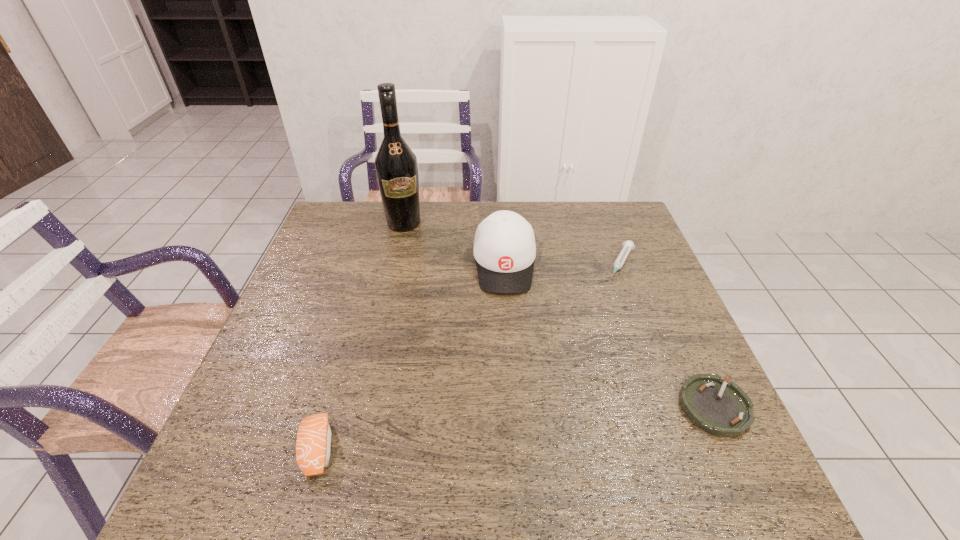
The height and width of the screenshot is (540, 960). Find the location of `free space at the near left corner of the desktop`. free space at the near left corner of the desktop is located at coordinates (270, 444).

Identify the location of vacant space at the far right corner. (x=629, y=223).

Where is `free region at the near right corner`? This screenshot has height=540, width=960. free region at the near right corner is located at coordinates (718, 437).

Where is `free space between the ashtray and the third tallest object`? This screenshot has width=960, height=540. free space between the ashtray and the third tallest object is located at coordinates (516, 428).

This screenshot has height=540, width=960. Identify the location of free space between the syringe and the third object from left to right. (563, 264).

Where is `vacant area between the syringe and the ashtray`? The image size is (960, 540). vacant area between the syringe and the ashtray is located at coordinates (668, 335).

This screenshot has width=960, height=540. I want to click on empty space that is in between the third tallest object and the tallest object, so click(x=361, y=336).

Locate an element on the screen. free space between the second tallest object and the sushi is located at coordinates (411, 356).

Where is `free spot between the ashtray and the farthest object`? This screenshot has height=540, width=960. free spot between the ashtray and the farthest object is located at coordinates (559, 315).

At what (x,y) coordinates should I click in order to perform the action: click on free space between the ashtray and the second tallest object. Please return your answer as a coordinate pair (x, y). The width and height of the screenshot is (960, 540). Looking at the image, I should click on (610, 336).